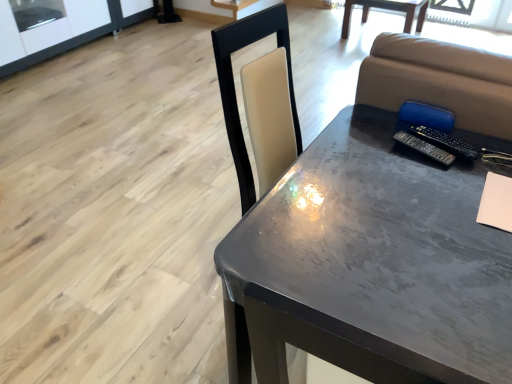
At what (x,y) coordinates should I click in order to perform the action: click on vacant space to the right of black plastic remote at upper right, which is counted as the first remote, starting from the right. Please return your answer as a coordinate pair (x, y). Looking at the image, I should click on (483, 148).